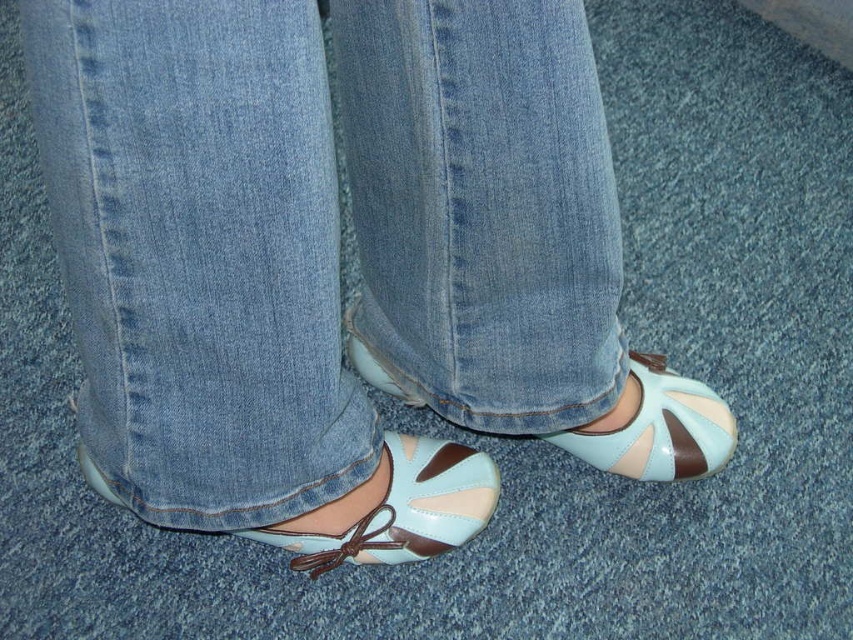
Question: Can you confirm if light blue denim jeans at center is positioned to the left of light blue patent leather sandal at center?

Choices:
 (A) yes
 (B) no

Answer: (A)

Question: Is light blue patent leather sandal at lower center thinner than light blue patent leather sandal at center?

Choices:
 (A) yes
 (B) no

Answer: (B)

Question: Is light blue denim jeans at center to the right of light blue patent leather sandal at center from the viewer's perspective?

Choices:
 (A) yes
 (B) no

Answer: (B)

Question: Which object is the closest to the light blue denim jeans at center?

Choices:
 (A) light blue patent leather shoe at center
 (B) light blue patent leather sandal at lower center
 (C) light blue patent leather sandal at center

Answer: (B)

Question: Which of the following is the closest to the observer?

Choices:
 (A) light blue patent leather sandal at lower center
 (B) light blue denim jeans at center
 (C) light blue patent leather shoe at center
 (D) light blue patent leather sandal at center

Answer: (B)

Question: Which point is farther from the camera taking this photo?

Choices:
 (A) (653, 468)
 (B) (363, 356)
 (C) (375, 556)

Answer: (B)